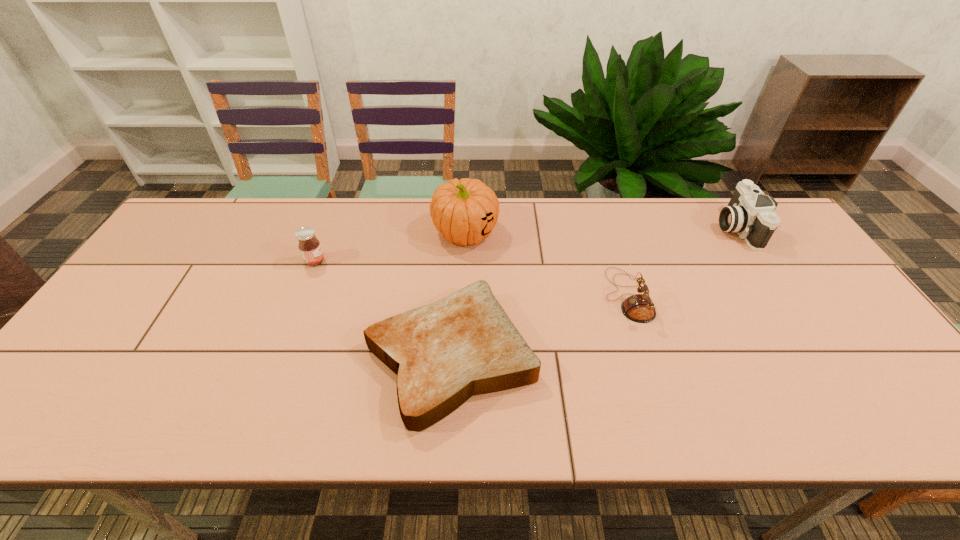
At what (x,y) coordinates should I click in order to perform the action: click on vacant area situated 0.280m on the label side of the third shortest object. Please return your answer as a coordinate pair (x, y). This screenshot has width=960, height=540. Looking at the image, I should click on (421, 261).

The width and height of the screenshot is (960, 540). Find the location of `free space located 0.130m on the rotary dial of the second shortest object`. free space located 0.130m on the rotary dial of the second shortest object is located at coordinates (557, 296).

At what (x,y) coordinates should I click in order to perform the action: click on vacant space located on the rotary dial of the second shortest object. Please return your answer as a coordinate pair (x, y). This screenshot has height=540, width=960. Looking at the image, I should click on (587, 296).

What are the coordinates of `free space located on the rotary dial of the second shortest object` in the screenshot? It's located at tap(478, 296).

I want to click on vacant space situated 0.240m on the back of the bread, so click(x=458, y=239).

At what (x,y) coordinates should I click in order to perform the action: click on pumpkin present at the far edge. Please return your answer as a coordinate pair (x, y). Image resolution: width=960 pixels, height=540 pixels. Looking at the image, I should click on [x=465, y=211].

Image resolution: width=960 pixels, height=540 pixels. In order to click on camera situated at the far edge in this screenshot , I will do `click(750, 213)`.

Where is `object that is at the near edge`? object that is at the near edge is located at coordinates (443, 353).

Image resolution: width=960 pixels, height=540 pixels. Identify the location of object located in the right edge section of the desktop. (750, 213).

The height and width of the screenshot is (540, 960). Find the location of `object located in the far right corner section of the desktop`. object located in the far right corner section of the desktop is located at coordinates 750,213.